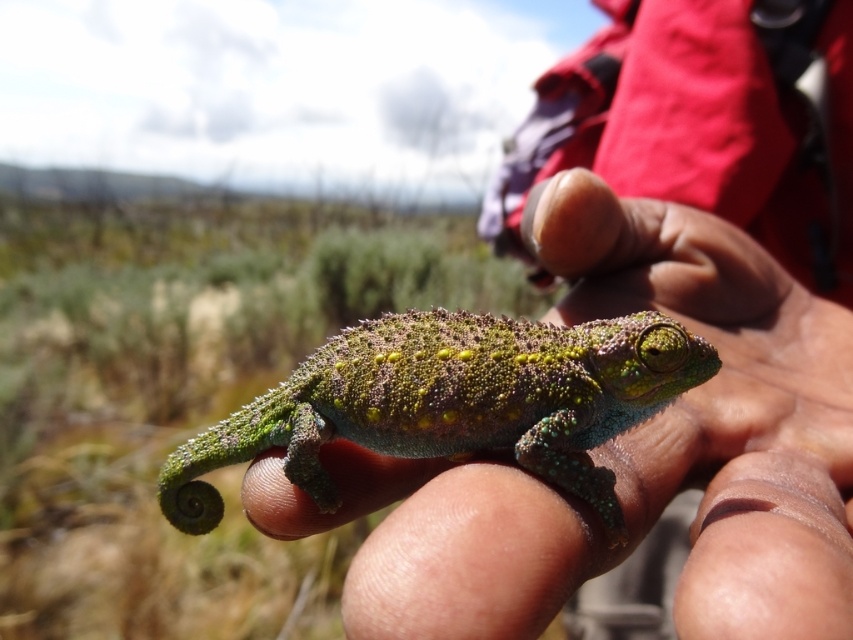
Question: Among these objects, which one is farthest from the camera?

Choices:
 (A) green scaly chameleon at center
 (B) green scaly lizard at center

Answer: (B)

Question: Which point is farther to the camera?

Choices:
 (A) (706, 257)
 (B) (692, 346)

Answer: (A)

Question: Does green scaly chameleon at center have a larger size compared to green scaly lizard at center?

Choices:
 (A) no
 (B) yes

Answer: (B)

Question: Among these objects, which one is farthest from the camera?

Choices:
 (A) green scaly lizard at center
 (B) green scaly chameleon at center

Answer: (A)

Question: Does green scaly chameleon at center lie behind green scaly lizard at center?

Choices:
 (A) yes
 (B) no

Answer: (B)

Question: Does green scaly chameleon at center have a lesser width compared to green scaly lizard at center?

Choices:
 (A) no
 (B) yes

Answer: (A)